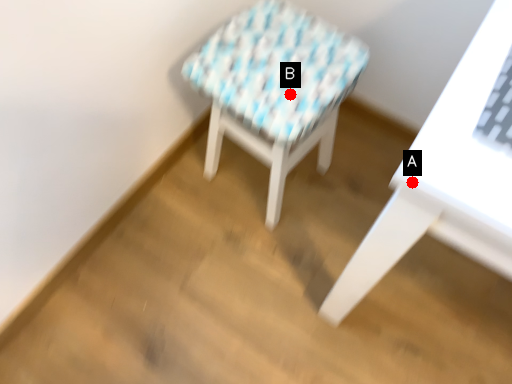
Question: Two points are circled on the image, labeled by A and B beside each circle. Which point is farther to the camera?

Choices:
 (A) A is further
 (B) B is further

Answer: (B)